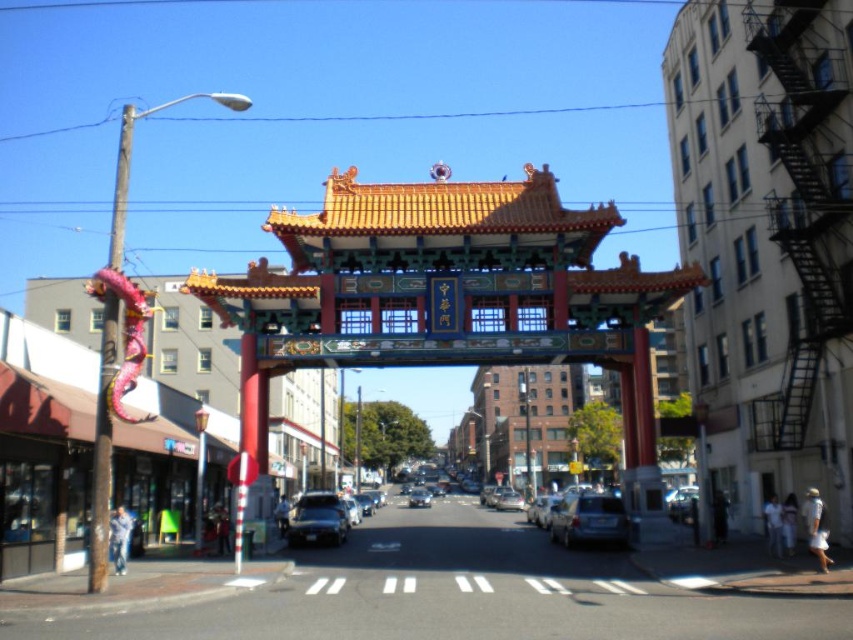
Question: Which object is closer to the camera taking this photo?

Choices:
 (A) metallic silver sedan at center
 (B) matte silver suv at center

Answer: (B)

Question: Can you confirm if matte silver suv at center is positioned below metallic silver car at center?

Choices:
 (A) no
 (B) yes

Answer: (A)

Question: Which point is farther to the camera?

Choices:
 (A) metallic silver car at center
 (B) matte silver suv at center
 (C) metallic silver sedan at center

Answer: (A)

Question: Can you confirm if matte silver suv at center is positioned to the right of metallic silver car at center?

Choices:
 (A) no
 (B) yes

Answer: (B)

Question: Which point is farther to the camera?

Choices:
 (A) (412, 499)
 (B) (589, 509)

Answer: (A)

Question: Can you confirm if matte silver suv at center is positioned to the left of metallic silver car at center?

Choices:
 (A) no
 (B) yes

Answer: (A)